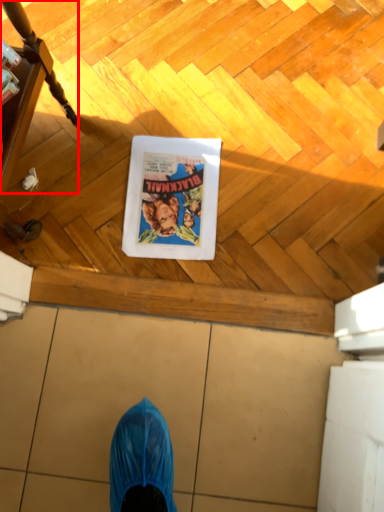
Question: From the image's perspective, what is the correct spatial relationship of furniture (annotated by the red box) in relation to comic book character?

Choices:
 (A) above
 (B) below

Answer: (A)